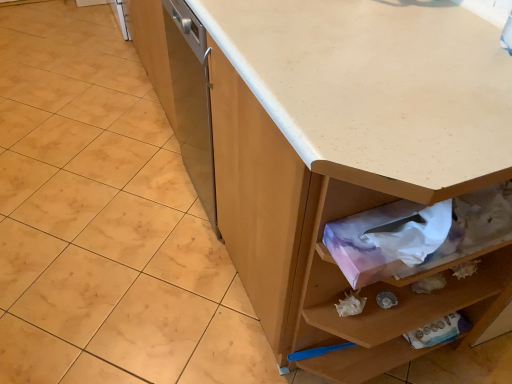
Find the location of `vacant position to the left of white laminate countertop at center`. vacant position to the left of white laminate countertop at center is located at coordinates (139, 278).